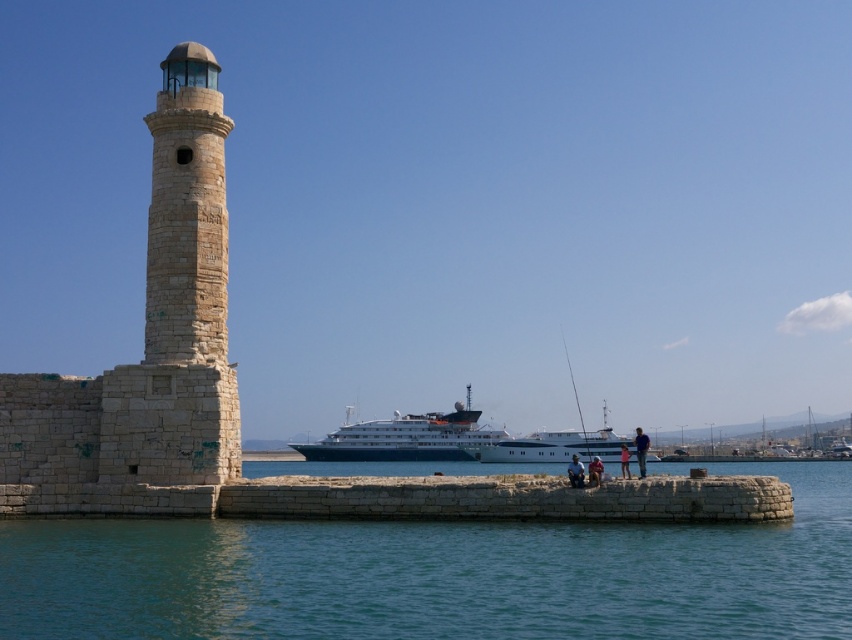
Can you confirm if white glossy cruise ship at center is thinner than white glossy yacht at center?

In fact, white glossy cruise ship at center might be wider than white glossy yacht at center.

Between point (354, 442) and point (534, 436), which one is positioned in front?

Point (354, 442) is more forward.

Image resolution: width=852 pixels, height=640 pixels. What do you see at coordinates (406, 436) in the screenshot?
I see `white glossy cruise ship at center` at bounding box center [406, 436].

Find the location of a particular element. Image resolution: width=852 pixels, height=640 pixels. white glossy cruise ship at center is located at coordinates (406, 436).

The width and height of the screenshot is (852, 640). Describe the element at coordinates (642, 449) in the screenshot. I see `light brown wooden chair at lower center` at that location.

Is light brown wooden chair at lower center bigger than blue denim jeans at center?

Indeed, light brown wooden chair at lower center has a larger size compared to blue denim jeans at center.

Does point (642, 436) lie in front of point (580, 476)?

No, (642, 436) is behind (580, 476).

I want to click on light brown wooden chair at lower center, so click(642, 449).

Is point (492, 458) in front of point (626, 467)?

No, (492, 458) is behind (626, 467).

Can you confirm if white glossy yacht at center is smaller than pink fabric shorts at lower center?

No.

Does point (568, 438) come behind point (629, 477)?

Yes, point (568, 438) is farther from viewer.

Locate an element on the screen. Image resolution: width=852 pixels, height=640 pixels. white glossy yacht at center is located at coordinates (556, 445).